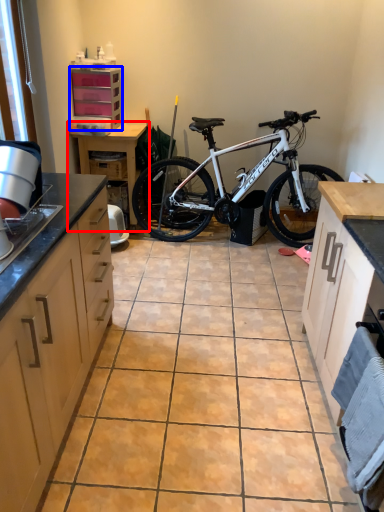
Question: Which point is closer to the camera, table (highlighted by a red box) or cabinetry (highlighted by a blue box)?

Choices:
 (A) table
 (B) cabinetry

Answer: (B)